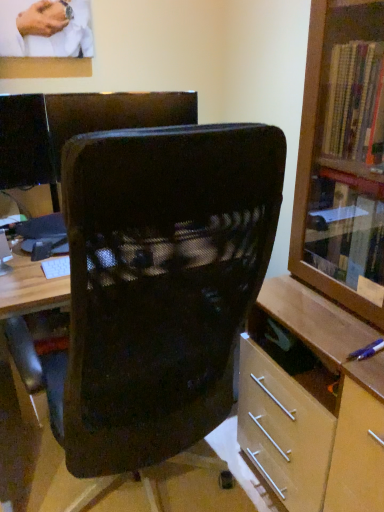
Question: Considering their positions, is black mesh chair at center located in front of or behind wooden cabinet at right?

Choices:
 (A) behind
 (B) front

Answer: (A)

Question: Does point 165,225 appear closer or farther from the camera than point 379,116?

Choices:
 (A) closer
 (B) farther

Answer: (A)

Question: From a real-world perspective, is black mesh chair at center positioned above or below wooden cabinet at right?

Choices:
 (A) above
 (B) below

Answer: (B)

Question: From the image's perspective, is wooden cabinet at right located above or below black mesh chair at center?

Choices:
 (A) above
 (B) below

Answer: (A)

Question: Based on their sizes in the image, would you say wooden cabinet at right is bigger or smaller than black mesh chair at center?

Choices:
 (A) big
 (B) small

Answer: (B)

Question: Is point (377, 413) closer or farther from the camera than point (170, 393)?

Choices:
 (A) closer
 (B) farther

Answer: (A)

Question: Considering the positions of wooden cabinet at right and black mesh chair at center in the image, is wooden cabinet at right wider or thinner than black mesh chair at center?

Choices:
 (A) wide
 (B) thin

Answer: (B)